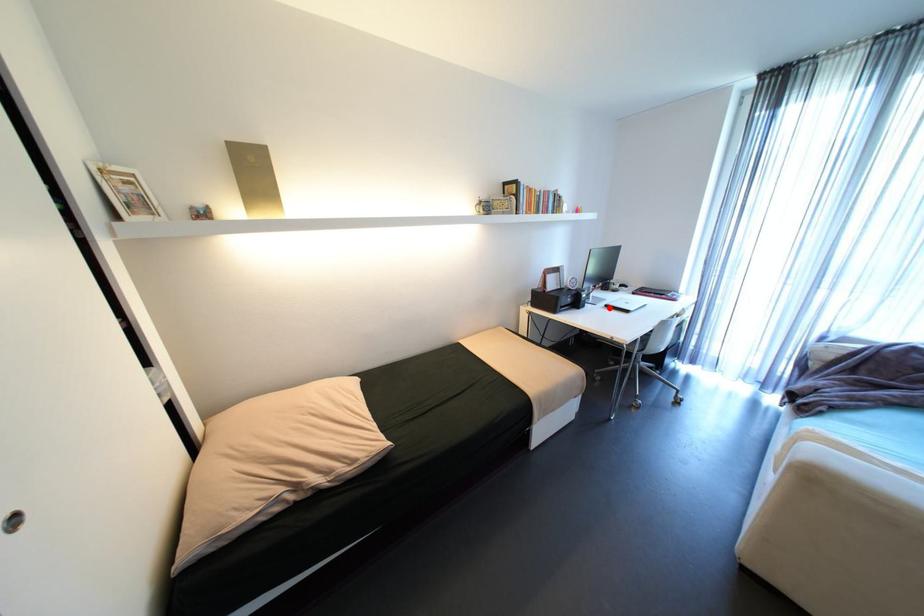
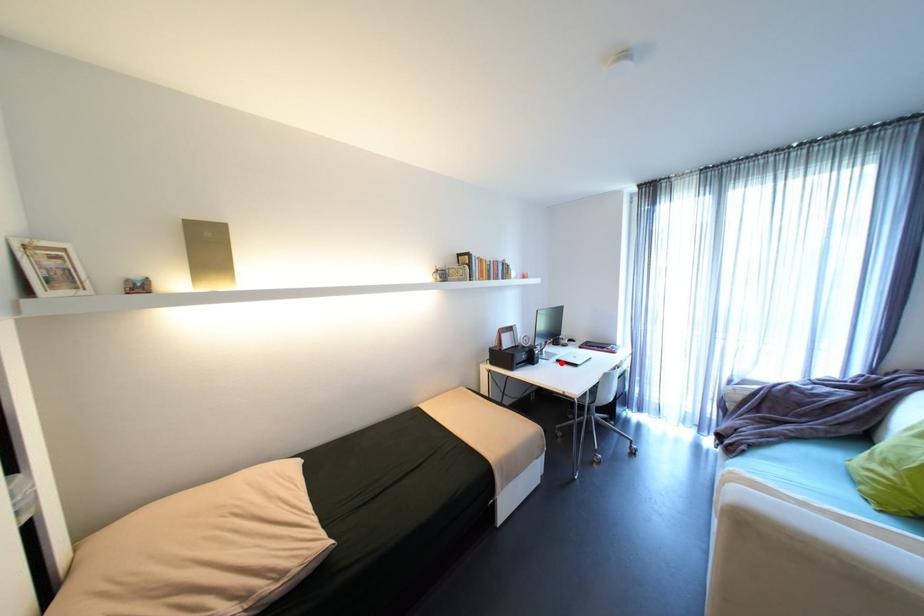
I am providing you with two images of the same scene from different viewpoints. A red point is marked on the first image and another point is marked on the second image. Is the marked point in image1 the same physical position as the marked point in image2?

Yes